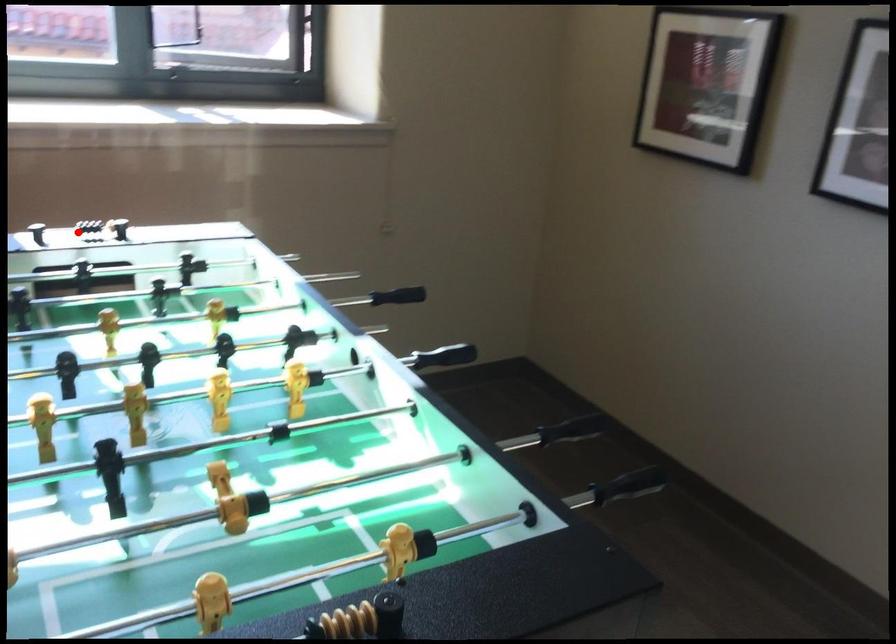
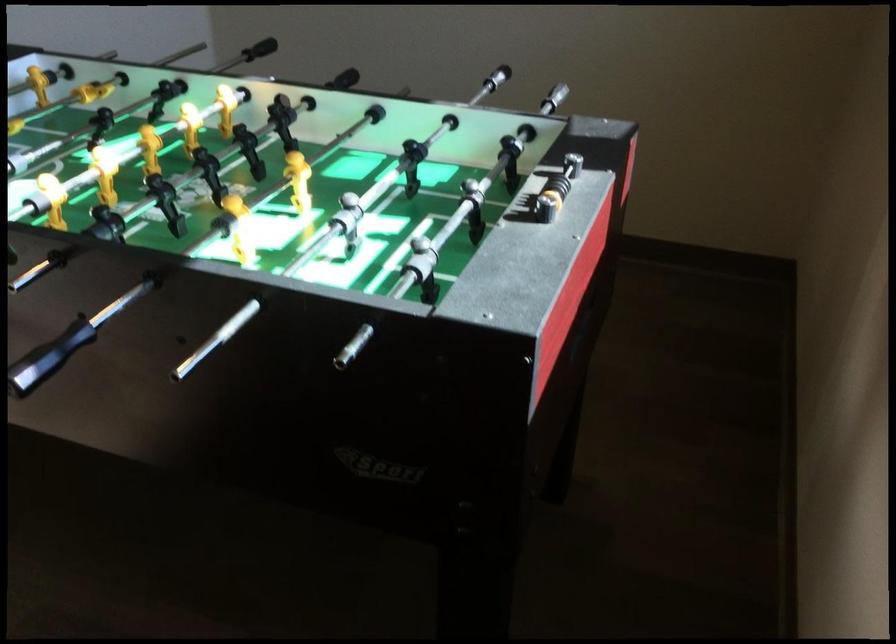
Where in the second image is the point corresponding to the highlighted location from the first image?

(556, 185)